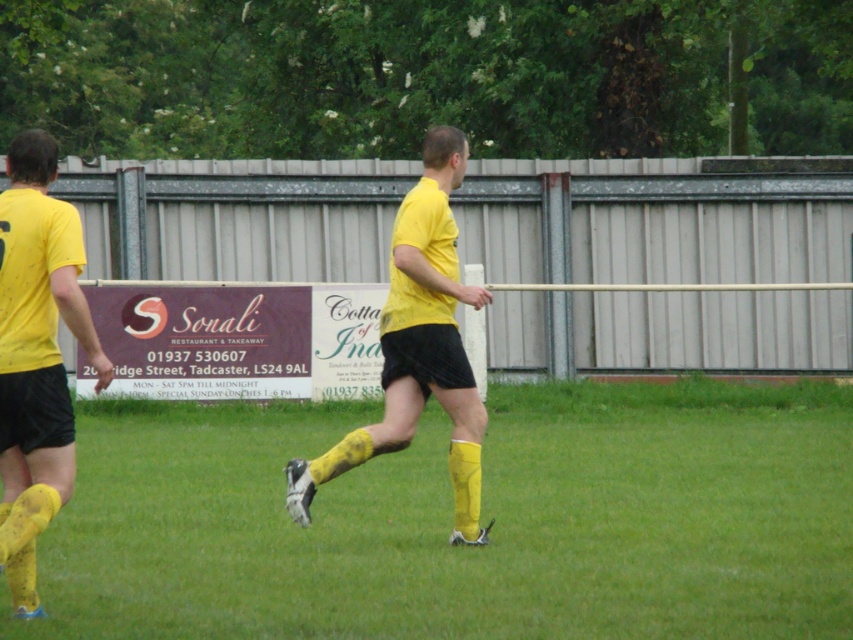
Is point (799, 440) positioned before point (73, 260)?

No.

Identify the location of green grass at center. Image resolution: width=853 pixels, height=640 pixels. (450, 520).

How far apart are green grass at center and yellow matte shorts at center?

A distance of 9.21 feet exists between green grass at center and yellow matte shorts at center.

Is green grass at center bigger than yellow matte shorts at center?

Answer: Yes.

Who is more distant from viewer, (509,548) or (431,360)?

Point (509,548)

The image size is (853, 640). I want to click on green grass at center, so click(x=450, y=520).

Is yellow matte shorts at left positioned before yellow matte shorts at center?

Yes.

Who is more distant from viewer, (x=55, y=314) or (x=408, y=364)?

The point (x=408, y=364) is behind.

What are the coordinates of `yellow matte shorts at left` in the screenshot? It's located at (36, 355).